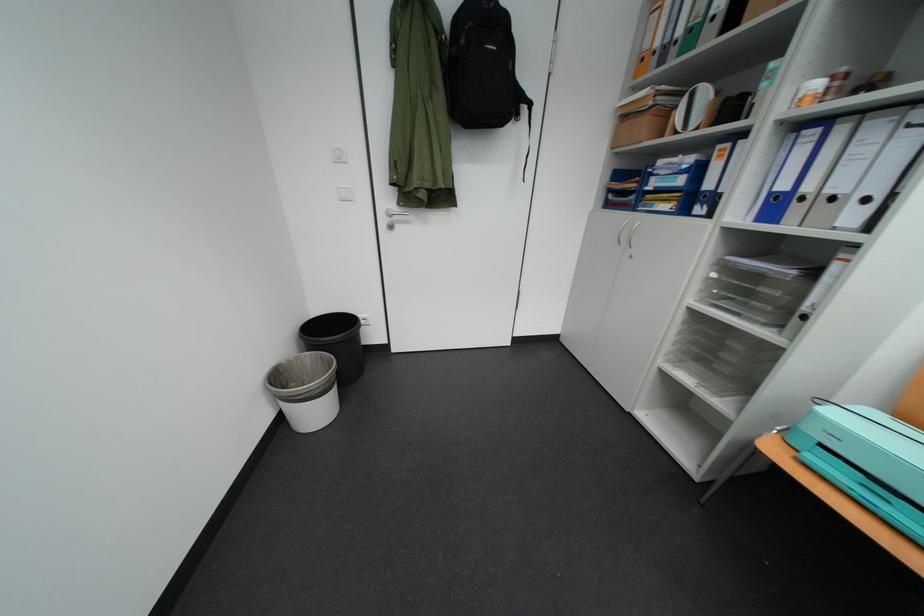
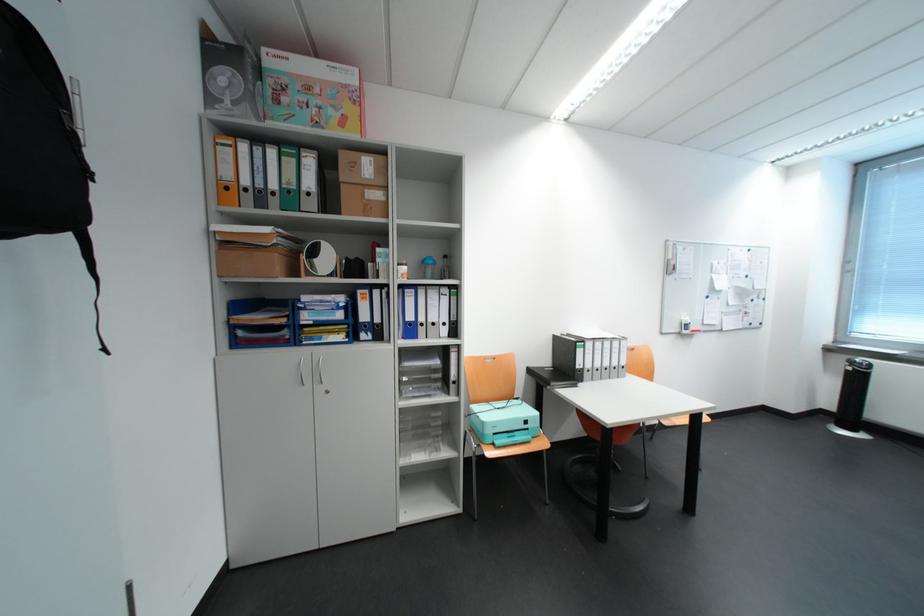
In the second image, find the point that corresponds to (x=690, y=33) in the first image.

(285, 188)